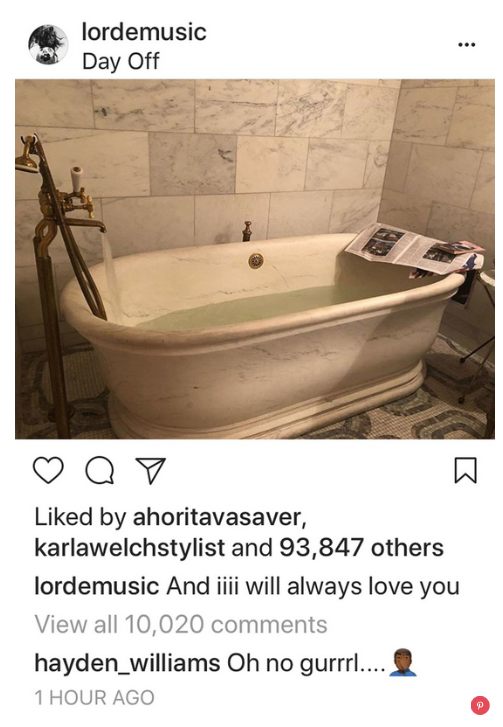
Image resolution: width=503 pixels, height=727 pixels. Find the location of `right tile wall`. right tile wall is located at coordinates (444, 161).